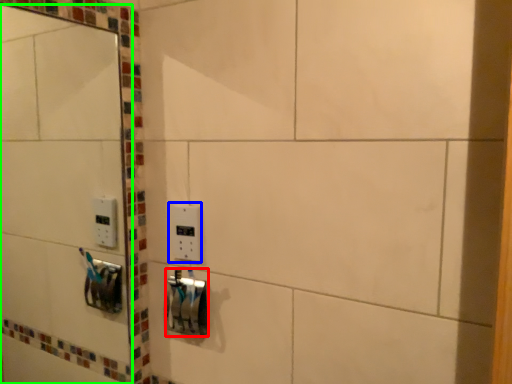
Question: Based on their relative distances, which object is farther from lock (highlighted by a red box)? Choose from light switch (highlighted by a blue box) and mirror (highlighted by a green box).

Choices:
 (A) light switch
 (B) mirror

Answer: (B)